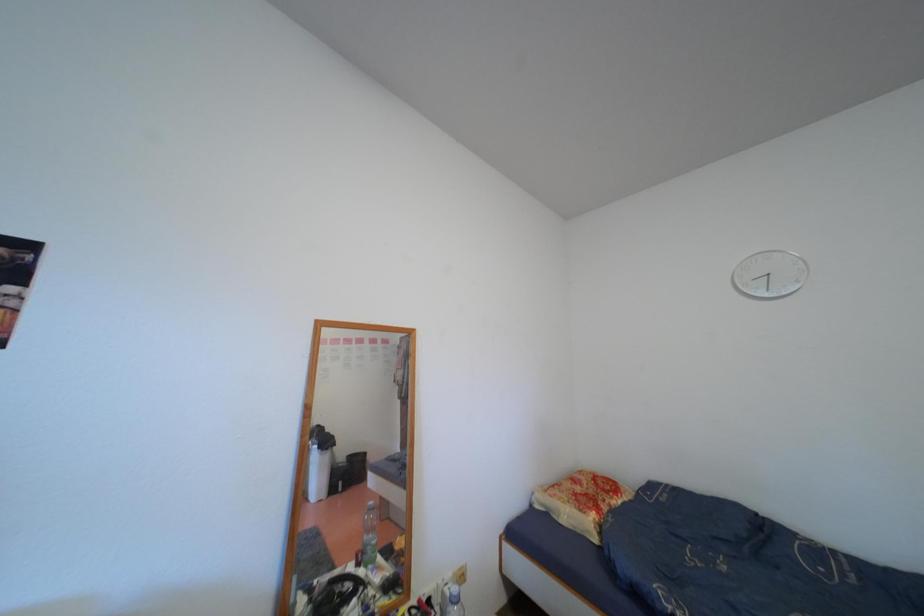
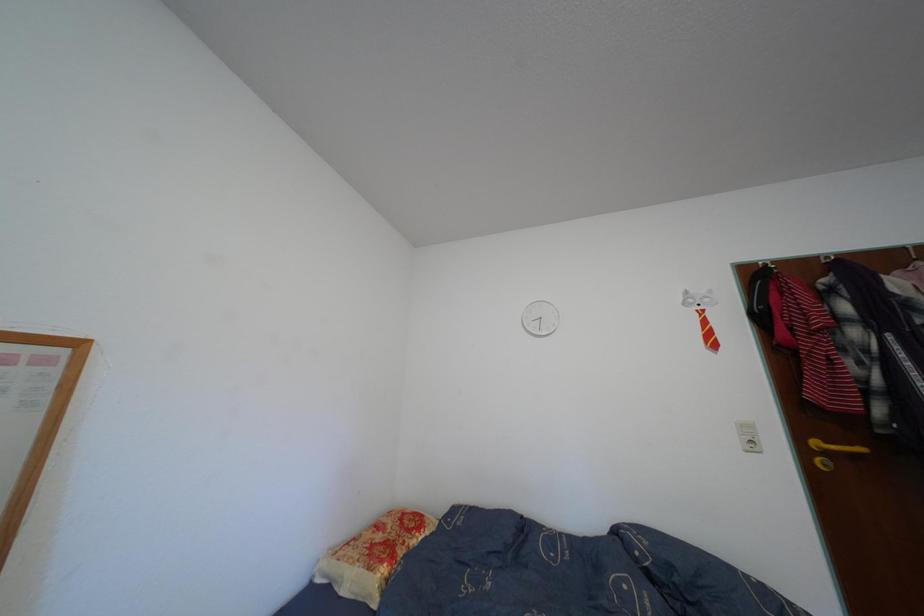
Question: The first image is from the beginning of the video and the second image is from the end. How did the camera likely rotate when shooting the video?

Choices:
 (A) Left
 (B) Right
 (C) Up
 (D) Down

Answer: (B)